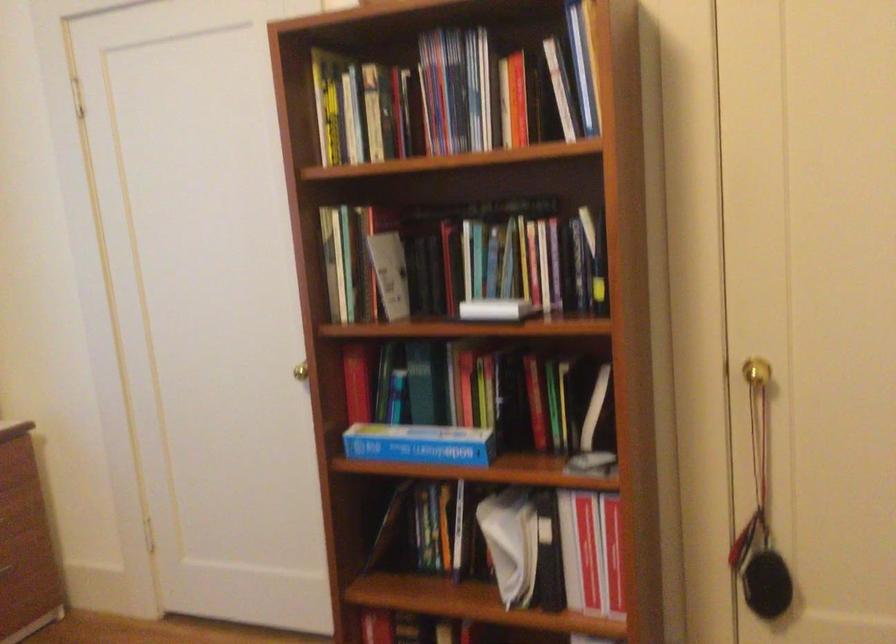
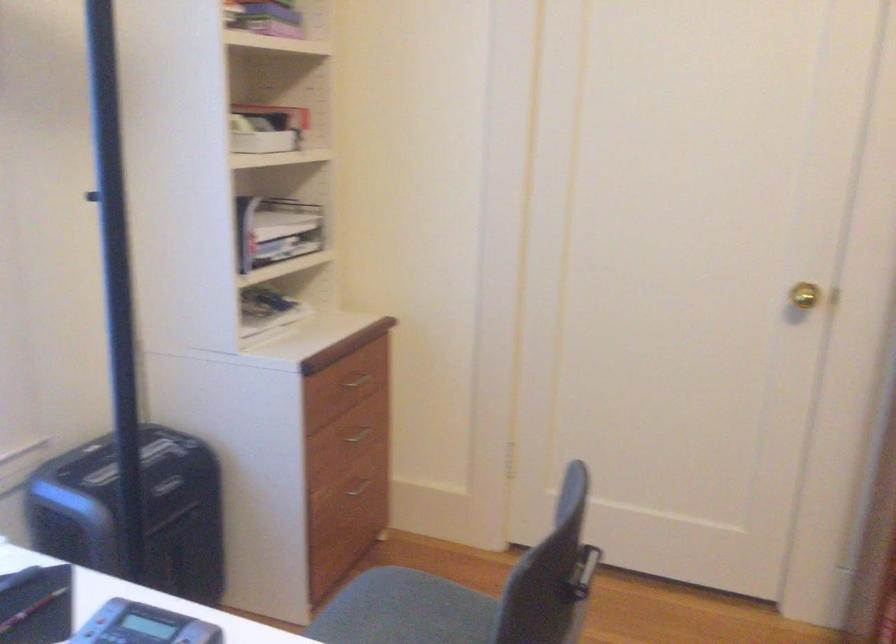
Find the pixel in the second image that matches (291,368) in the first image.

(804, 295)